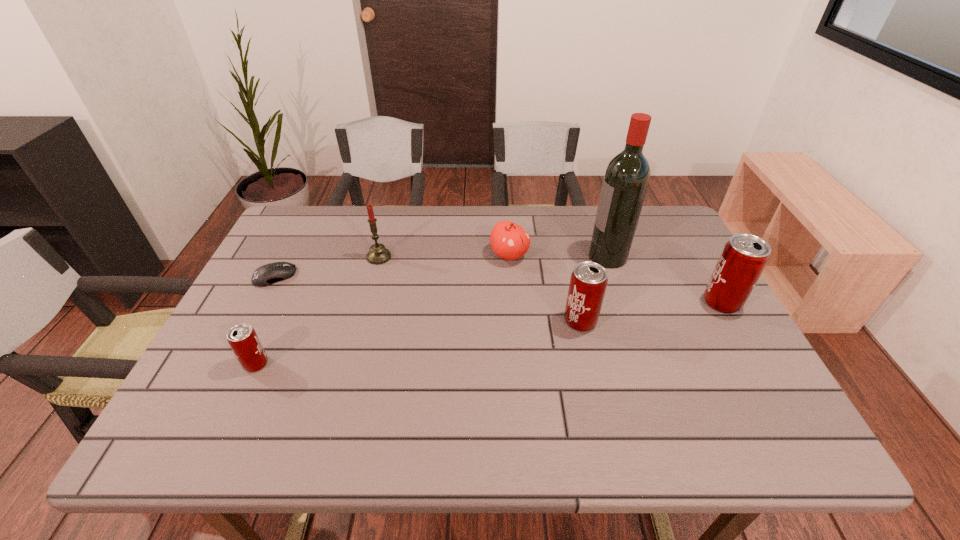
Identify the location of the nearest object. (242, 338).

Locate an element on the screen. This screenshot has width=960, height=540. the leftmost beer can is located at coordinates (242, 338).

You are a GUI agent. You are given a task and a screenshot of the screen. Output one action in this format:
    pyautogui.click(x=<x>, y=<y>)
    Task: Click on the second beer can from left to right
    This screenshot has height=540, width=960.
    Given the screenshot: What is the action you would take?
    pyautogui.click(x=588, y=282)

Where is `the fifth object from left to right`? the fifth object from left to right is located at coordinates (588, 282).

At what (x,y) coordinates should I click in order to perform the action: click on the rightmost object. Please return your answer as a coordinate pair (x, y). Looking at the image, I should click on (744, 257).

Identify the location of the fourth object from right to left. This screenshot has width=960, height=540. (509, 241).

At what (x,y) coordinates should I click in order to perform the action: click on wine bottle. Please return your answer as a coordinate pair (x, y). Looking at the image, I should click on (627, 176).

I want to click on the tallest object, so click(x=627, y=176).

Image resolution: width=960 pixels, height=540 pixels. Identify the location of the fifth object from right to left. (378, 254).

You are a GUI agent. You are given a task and a screenshot of the screen. Output one action in this format:
    pyautogui.click(x=<x>, y=<y>)
    Task: Click on the computer equipment
    
    Given the screenshot: What is the action you would take?
    pyautogui.click(x=271, y=273)